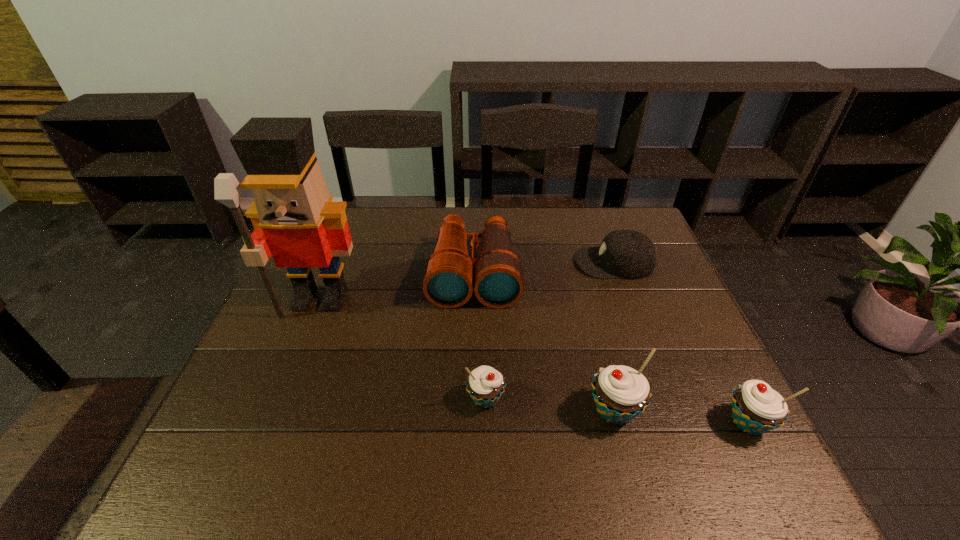
The width and height of the screenshot is (960, 540). In order to click on free space located 0.320m on the front-facing side of the cap in this screenshot , I will do [x=469, y=262].

The height and width of the screenshot is (540, 960). In order to click on vacant area situated on the front-facing side of the cap in this screenshot , I will do `click(536, 262)`.

Where is `blank space located on the front-facing side of the cap`? This screenshot has height=540, width=960. blank space located on the front-facing side of the cap is located at coordinates (490, 262).

You are a GUI agent. You are given a task and a screenshot of the screen. Output one action in this format:
    pyautogui.click(x=<x>, y=<y>)
    Task: Click on the vacant space located through the lenses of the binoculars
    Image resolution: width=960 pixels, height=540 pixels.
    Given the screenshot: What is the action you would take?
    pyautogui.click(x=471, y=431)

Find the location of `vacant region located in front of the nutcracker holding the staff`. vacant region located in front of the nutcracker holding the staff is located at coordinates (271, 428).

This screenshot has height=540, width=960. Find the location of `cap that is at the far edge`. cap that is at the far edge is located at coordinates (630, 254).

Identify the location of binoculars that is at the far edge. Image resolution: width=960 pixels, height=540 pixels. (448, 279).

The height and width of the screenshot is (540, 960). I want to click on object that is at the left edge, so click(x=294, y=219).

Where is `cupcake located at the right edge`? This screenshot has height=540, width=960. cupcake located at the right edge is located at coordinates (756, 408).

Find the location of `cap at the right edge`. cap at the right edge is located at coordinates (630, 254).